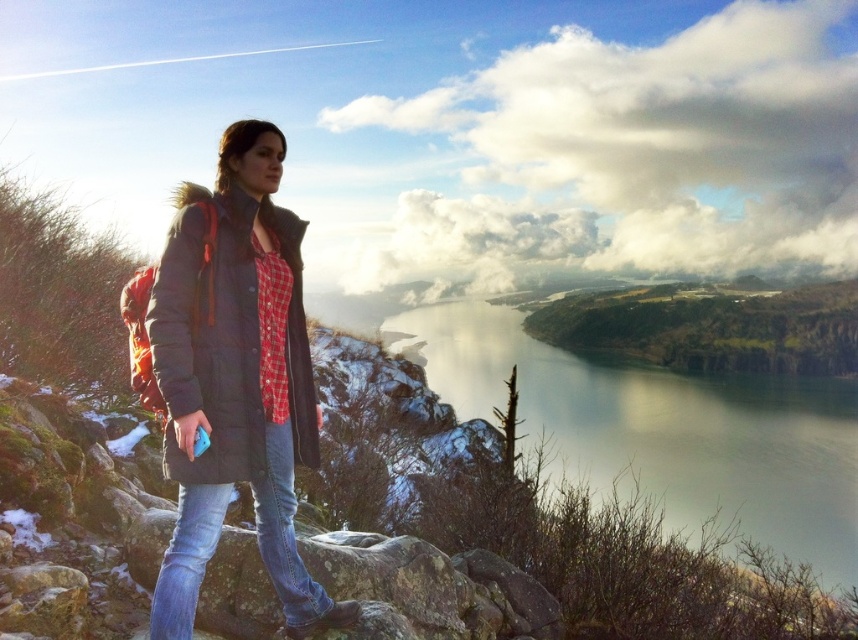
How far apart are green reflective water at center and green grassy hillside at upper center?

green reflective water at center is 31.15 meters from green grassy hillside at upper center.

Is green reflective water at center taller than green grassy hillside at upper center?

Yes, green reflective water at center is taller than green grassy hillside at upper center.

Is point (479, 412) positioned after point (841, 304)?

That is False.

This screenshot has height=640, width=858. Identify the location of green reflective water at center. (662, 429).

Can you confirm if matte black jacket at center is bigger than dark gray puffer jacket at left?

Yes, matte black jacket at center is bigger than dark gray puffer jacket at left.

Does point (174, 422) come farther from viewer compared to point (318, 448)?

No.

Identify the location of matte black jacket at center. Image resolution: width=858 pixels, height=640 pixels. (234, 378).

Does green reflective water at center have a greater width compared to blue denim jeans at lower left?

Correct, the width of green reflective water at center exceeds that of blue denim jeans at lower left.

Is the position of green reflective water at center more distant than that of blue denim jeans at lower left?

Yes, it is.

Who is more forward, (775, 493) or (267, 516)?

Point (267, 516) is more forward.

Image resolution: width=858 pixels, height=640 pixels. What are the coordinates of `green reflective water at center` in the screenshot? It's located at (662, 429).